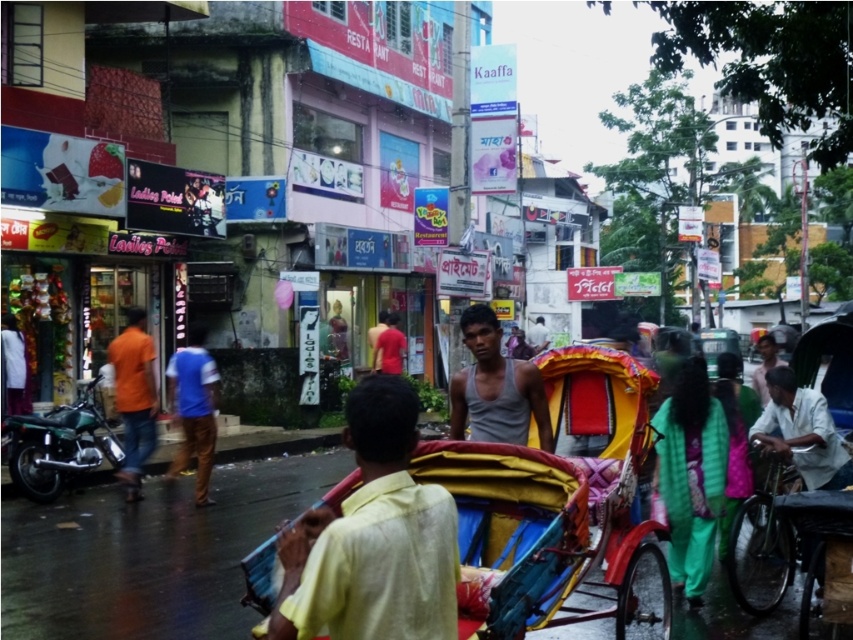
Question: Can you confirm if multicolored fabric rickshaw at center is positioned to the right of orange cotton shirt at left?

Choices:
 (A) no
 (B) yes

Answer: (B)

Question: Does gray matte tank top at center have a smaller size compared to orange cotton shirt at left?

Choices:
 (A) no
 (B) yes

Answer: (B)

Question: Which is nearer to the gray cotton shirt at center?

Choices:
 (A) multicolored fabric rickshaw at center
 (B) orange cotton shirt at left

Answer: (B)

Question: Among these objects, which one is farthest from the camera?

Choices:
 (A) blue cotton shirt at center
 (B) multicolored fabric rickshaw at center
 (C) light yellow cotton shirt at center

Answer: (A)

Question: From the image, what is the correct spatial relationship of gray matte tank top at center in relation to blue cotton shirt at center?

Choices:
 (A) left
 (B) right

Answer: (B)

Question: Which object is positioned farthest from the gray matte tank top at center?

Choices:
 (A) light yellow cotton shirt at center
 (B) blue cotton shirt at center
 (C) white cotton shirt at right

Answer: (B)